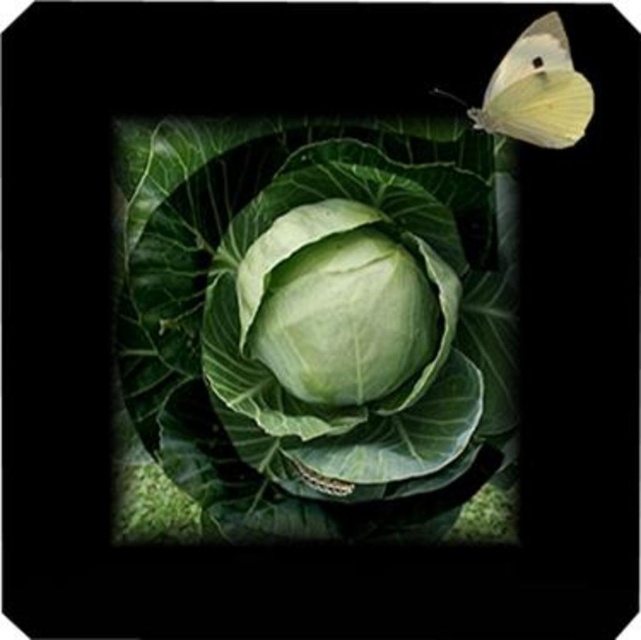
You are a gardener trying to harvest both the green smooth leafy vegetable at center and the green matte cabbage at center. If your basket can only hold one item at a time, which item should you pick first to minimize the distance you have to walk back and forth?

Both the green smooth leafy vegetable at center and the green matte cabbage at center are located at the center of the image, so there is no need to move between them. You can pick either one first without needing to walk back and forth since they are positioned closely together at the center, only 2.48 inches apart.

You are a gardener trying to place a protective cover over the green smooth leafy vegetable at center and the translucent yellow butterfly at upper right. Which object requires a larger cover in terms of width?

The green smooth leafy vegetable at center requires a larger cover because its width is greater than that of the translucent yellow butterfly at upper right.